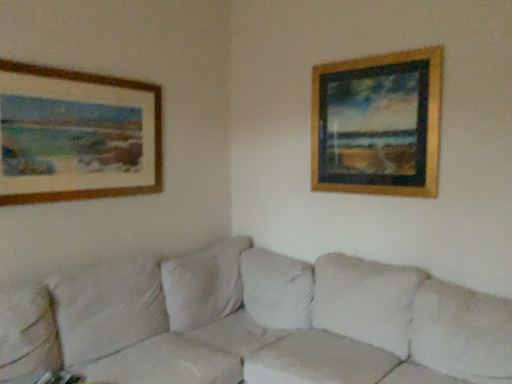
Question: Is gold wooden picture frame at upper right, the first picture frame positioned from the right, positioned far away from white fabric couch at center?

Choices:
 (A) no
 (B) yes

Answer: (A)

Question: Is gold wooden picture frame at upper right, the 2th picture frame positioned from the left, closer to camera compared to white fabric couch at center?

Choices:
 (A) no
 (B) yes

Answer: (A)

Question: Is gold wooden picture frame at upper right, the first picture frame positioned from the right, looking in the opposite direction of white fabric couch at center?

Choices:
 (A) no
 (B) yes

Answer: (A)

Question: Is gold wooden picture frame at upper right, the first picture frame positioned from the right, beside white fabric couch at center?

Choices:
 (A) no
 (B) yes

Answer: (A)

Question: Is gold wooden picture frame at upper right, the 2th picture frame positioned from the left, taller than white fabric couch at center?

Choices:
 (A) yes
 (B) no

Answer: (A)

Question: Considering the positions of point (123, 193) and point (332, 125), is point (123, 193) closer or farther from the camera than point (332, 125)?

Choices:
 (A) closer
 (B) farther

Answer: (A)

Question: Would you say wooden picture frame at upper left, which is the second picture frame in right-to-left order, is inside or outside gold wooden picture frame at upper right, the 2th picture frame positioned from the left?

Choices:
 (A) inside
 (B) outside

Answer: (B)

Question: Considering the positions of wooden picture frame at upper left, placed as the 1th picture frame when sorted from left to right, and gold wooden picture frame at upper right, the 2th picture frame positioned from the left, in the image, is wooden picture frame at upper left, placed as the 1th picture frame when sorted from left to right, wider or thinner than gold wooden picture frame at upper right, the 2th picture frame positioned from the left,?

Choices:
 (A) wide
 (B) thin

Answer: (B)

Question: Looking at the image, does wooden picture frame at upper left, which is the second picture frame in right-to-left order, seem bigger or smaller compared to gold wooden picture frame at upper right, the first picture frame positioned from the right?

Choices:
 (A) small
 (B) big

Answer: (A)

Question: From a real-world perspective, relative to wooden picture frame at upper left, which is the second picture frame in right-to-left order, is white fabric couch at center vertically above or below?

Choices:
 (A) below
 (B) above

Answer: (A)

Question: Is white fabric couch at center spatially inside wooden picture frame at upper left, placed as the 1th picture frame when sorted from left to right, or outside of it?

Choices:
 (A) outside
 (B) inside

Answer: (A)

Question: In the image, is white fabric couch at center on the left side or the right side of wooden picture frame at upper left, placed as the 1th picture frame when sorted from left to right?

Choices:
 (A) right
 (B) left

Answer: (A)

Question: Is white fabric couch at center in front of or behind wooden picture frame at upper left, placed as the 1th picture frame when sorted from left to right, in the image?

Choices:
 (A) front
 (B) behind

Answer: (A)

Question: From a real-world perspective, is gold wooden picture frame at upper right, the 2th picture frame positioned from the left, above or below white fabric couch at center?

Choices:
 (A) below
 (B) above

Answer: (B)

Question: Based on their sizes in the image, would you say gold wooden picture frame at upper right, the first picture frame positioned from the right, is bigger or smaller than white fabric couch at center?

Choices:
 (A) big
 (B) small

Answer: (B)